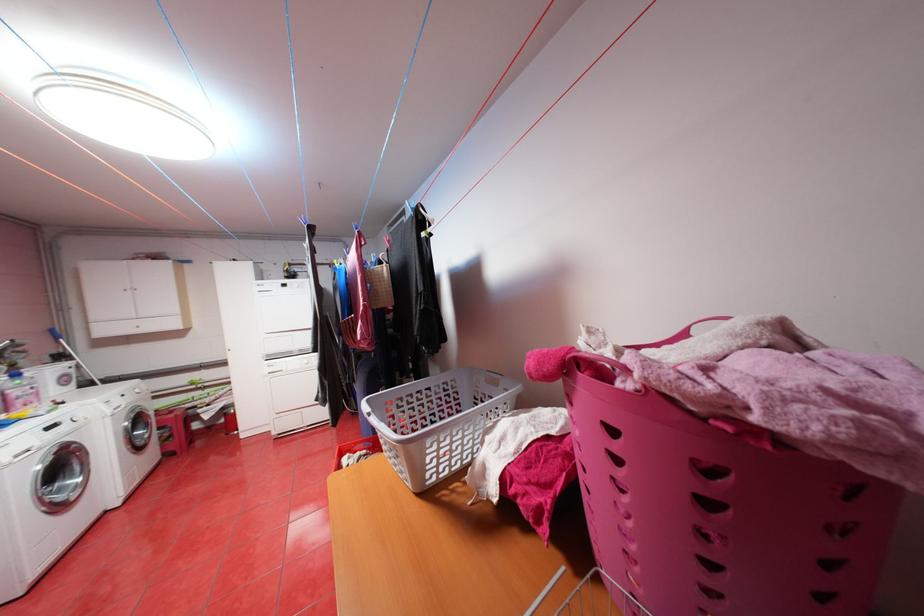
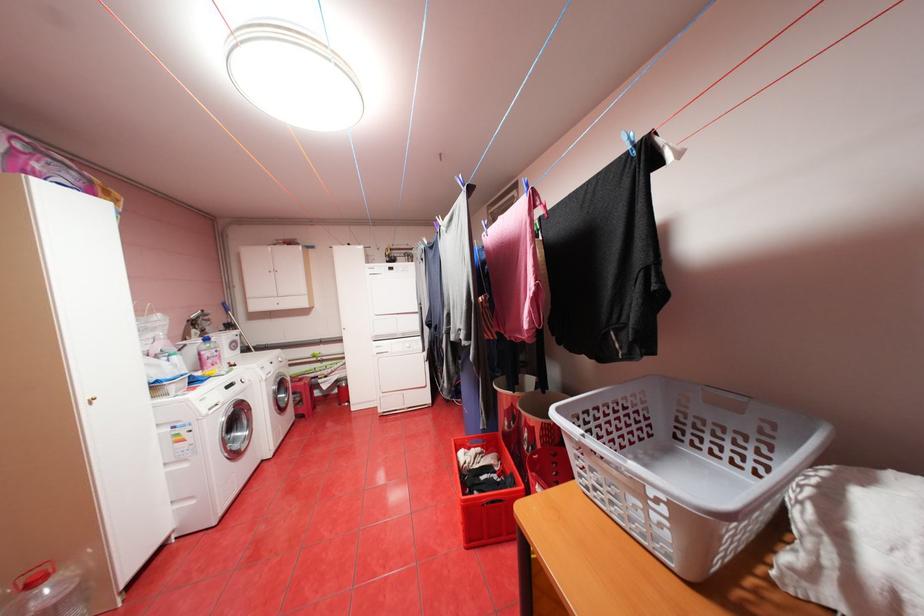
Where in the second image is the point corresponding to (372,451) from the first image?

(488, 448)